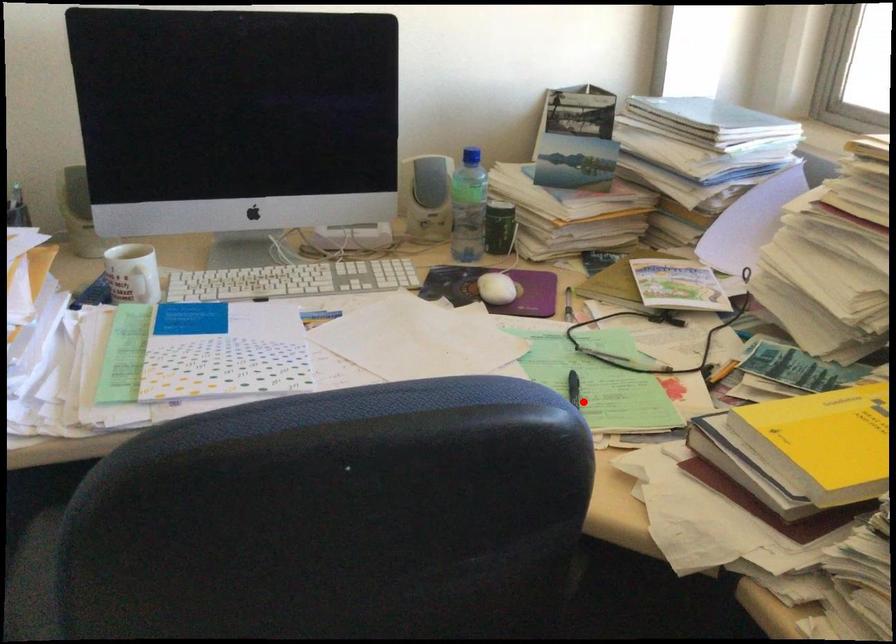
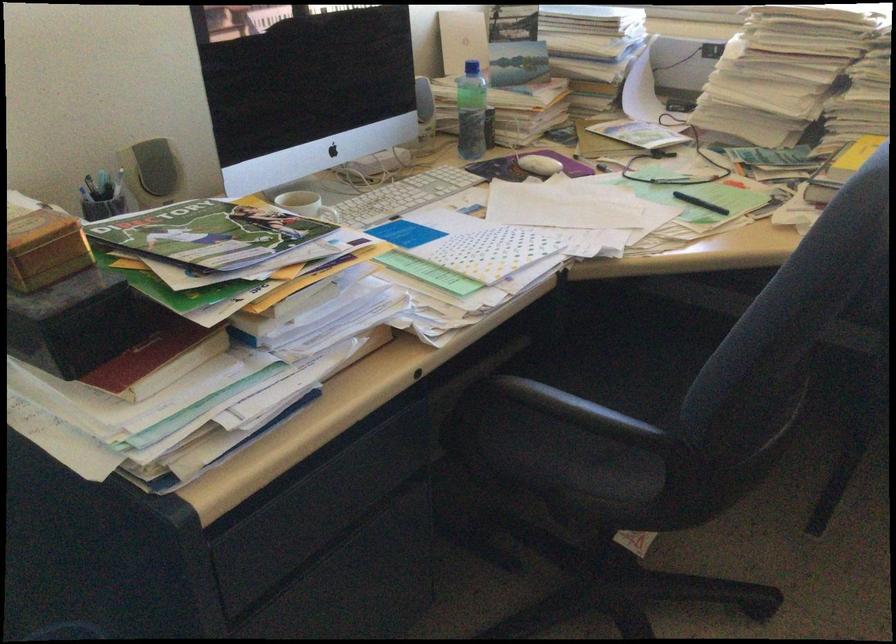
Where in the second image is the point corresponding to the highlighted location from the first image?

(700, 203)